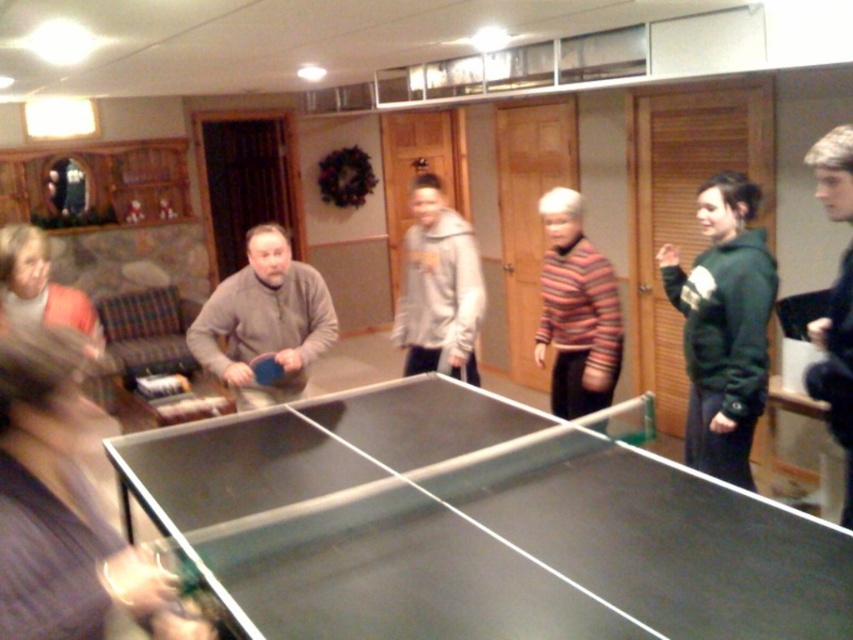
Describe the element at coordinates (62, 509) in the screenshot. I see `dark gray fabric shirt at lower left` at that location.

Which is more to the left, dark gray fabric shirt at lower left or gray matte ping pong paddle at center?

gray matte ping pong paddle at center

Is point (67, 544) more distant than point (299, 324)?

No, (67, 544) is closer to viewer.

At what (x,y) coordinates should I click in order to perform the action: click on dark gray fabric shirt at lower left. Please return your answer as a coordinate pair (x, y). Looking at the image, I should click on (62, 509).

Who is higher up, gray matte ping pong paddle at center or blonde hair at right?

gray matte ping pong paddle at center

Can you confirm if gray matte ping pong paddle at center is positioned below blonde hair at right?

No.

Who is more forward, (260, 296) or (845, 403)?

Positioned in front is point (845, 403).

Locate an element on the screen. The height and width of the screenshot is (640, 853). gray matte ping pong paddle at center is located at coordinates (264, 321).

Does dark gray fabric shirt at lower left appear under blonde hair at right?

Yes.

Where is `dark gray fabric shirt at lower left`? This screenshot has height=640, width=853. dark gray fabric shirt at lower left is located at coordinates (62, 509).

Identify the location of dark gray fabric shirt at lower left. (62, 509).